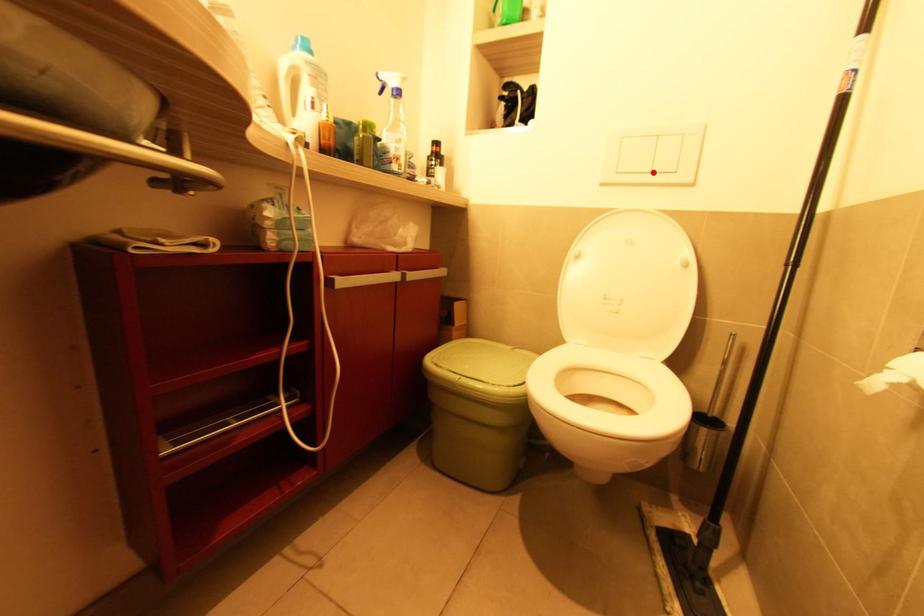
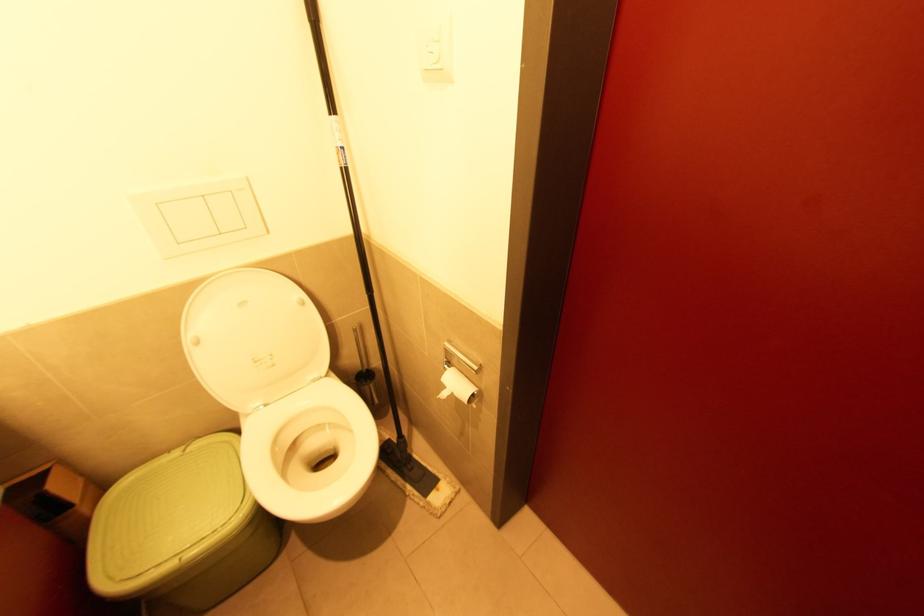
In the second image, find the point that corresponds to the highlighted location in the first image.

(224, 235)